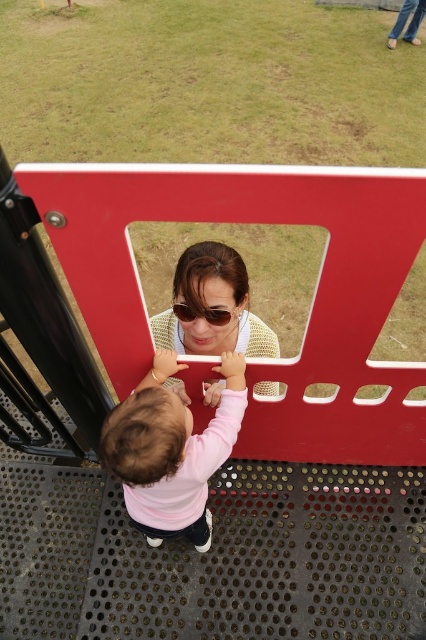
You are a safety inspector checking the playground equipment. You notice the pink fabric toddler at center and the sunglasses at center. Which object is bigger in size?

The pink fabric toddler at center is larger in size compared to the sunglasses at center.

A child is trying to reach a red safety gate while standing on a playground structure. The child is wearing a pink long sleeve shirt and dark pants. A woman with sunglasses is nearby. The pink fabric toddler at center and sunglasses at center are two objects in the scene. How far apart are these two objects?

The distance between the pink fabric toddler at center and the sunglasses at center is 17.58 inches.